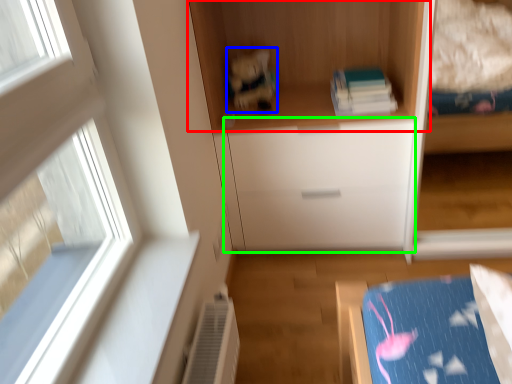
Question: Based on their relative distances, which object is nearer to cupboard (highlighted by a red box)? Choose from toy (highlighted by a blue box) and drawer (highlighted by a green box).

Choices:
 (A) toy
 (B) drawer

Answer: (A)